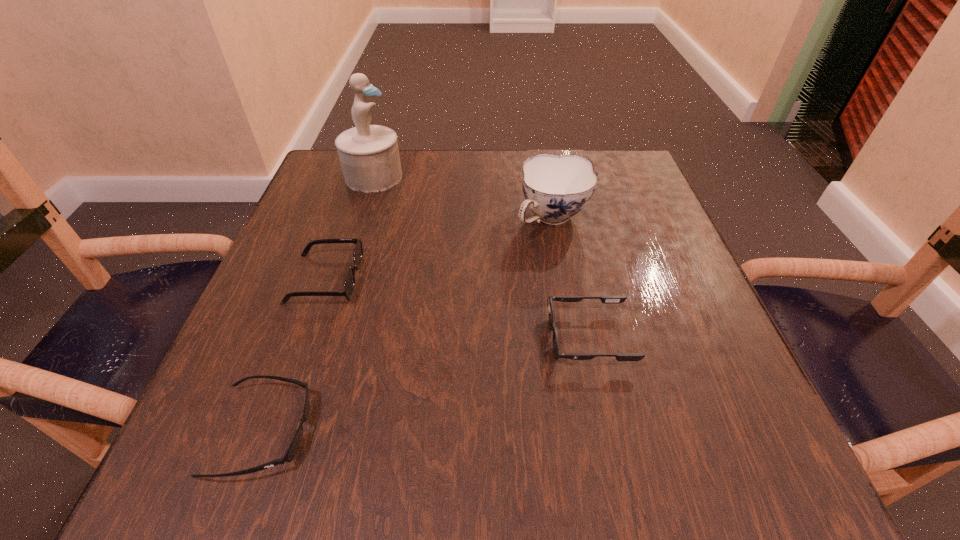
Locate an element on the screen. The width and height of the screenshot is (960, 540). chinaware present at the right edge is located at coordinates (556, 187).

Locate an element on the screen. The width and height of the screenshot is (960, 540). sunglasses at the right edge is located at coordinates [x=604, y=299].

Locate an element on the screen. The width and height of the screenshot is (960, 540). object that is at the far left corner is located at coordinates (369, 155).

You are a GUI agent. You are given a task and a screenshot of the screen. Output one action in this format:
    pyautogui.click(x=<x>, y=<y>)
    Task: Click on the object located in the near left corner section of the desktop
    
    Given the screenshot: What is the action you would take?
    tap(291, 452)

Image resolution: width=960 pixels, height=540 pixels. Identify the location of object that is positioned at the far right corner. (556, 187).

Identify the location of vacant space at the far edge. (483, 193).

The height and width of the screenshot is (540, 960). I want to click on free region at the near edge of the desktop, so click(639, 430).

The height and width of the screenshot is (540, 960). Find the location of `vacant area at the left edge`. vacant area at the left edge is located at coordinates (317, 244).

Where is `vacant space at the right edge`? This screenshot has width=960, height=540. vacant space at the right edge is located at coordinates (674, 259).

What are the coordinates of `vacant region at the far left corner` in the screenshot? It's located at (324, 186).